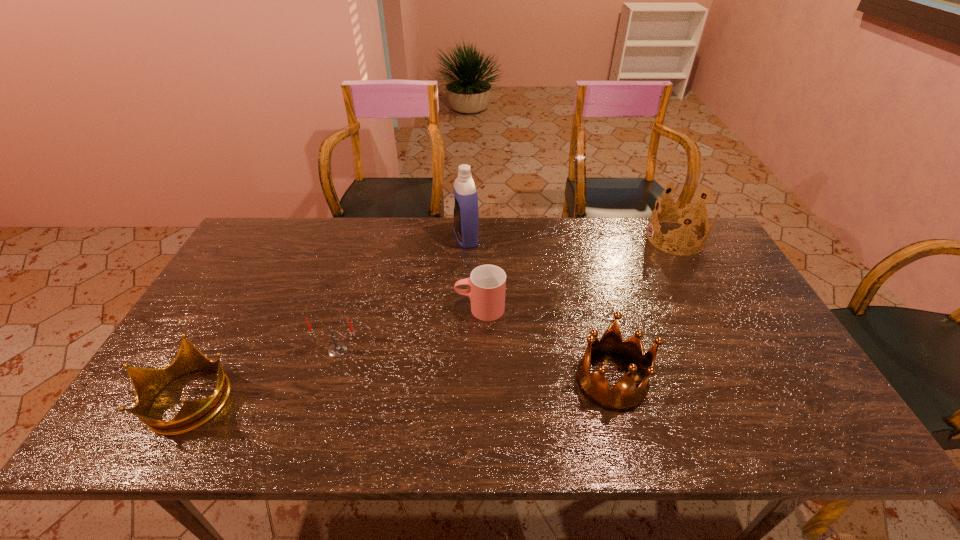
This screenshot has width=960, height=540. Identify the location of free space that satisfies the following two spatial constraints: 1. on the side of the rightmost object with the handle; 2. on the left side of the cup. pos(480,238).